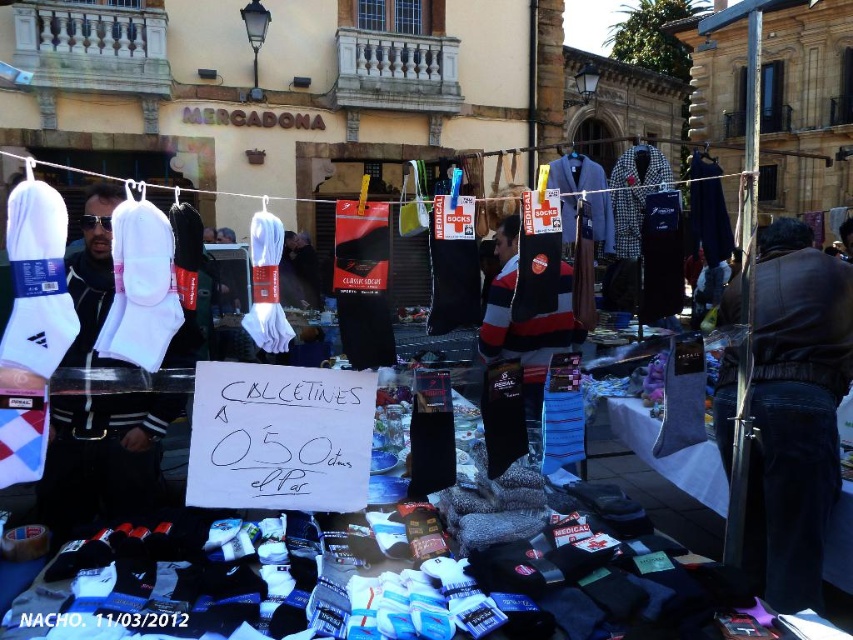
You are a customer at the market and want to buy socks. You see the dark brown leather jacket at right. Where is the jacket positioned relative to the socks?

The dark brown leather jacket at right is located at point (793, 412), which is to the right side of the socks displayed on the clothesline.